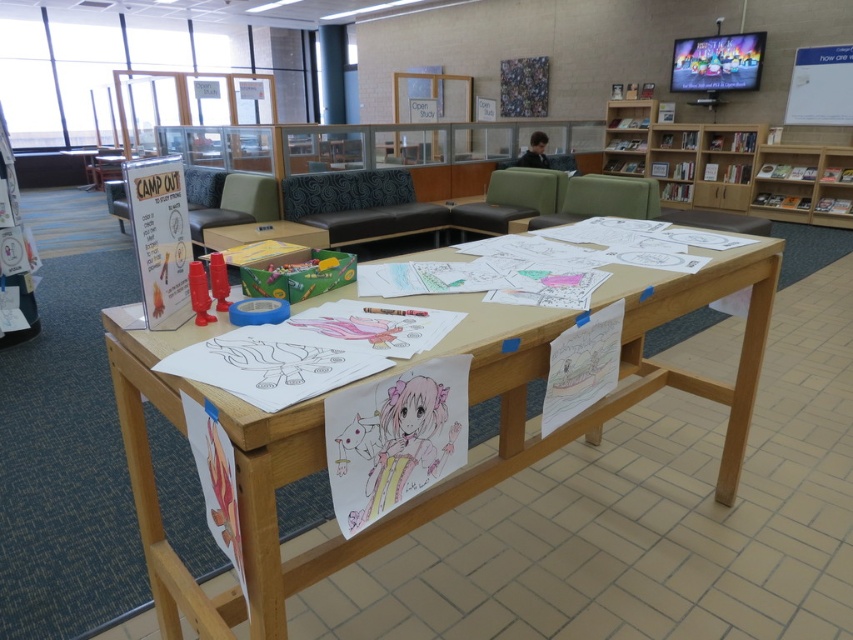
Which of these two, wooden table at center or wooden bookshelf at upper right, stands shorter?

Standing shorter between the two is wooden table at center.

In the scene shown: Who is lower down, wooden table at center or wooden bookshelf at upper right?

wooden table at center is lower down.

Who is more distant from viewer, (x=271, y=544) or (x=817, y=193)?

Positioned behind is point (x=817, y=193).

At what (x,y) coordinates should I click in order to perform the action: click on wooden table at center. Please return your answer as a coordinate pair (x, y). Image resolution: width=853 pixels, height=640 pixels. Looking at the image, I should click on (469, 403).